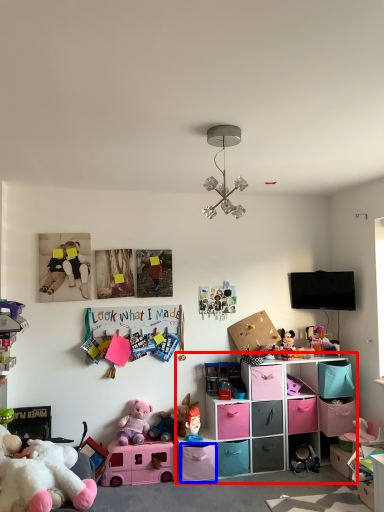
Question: Among these objects, which one is farthest to the camera, shelf (highlighted by a red box) or storage box (highlighted by a blue box)?

Choices:
 (A) shelf
 (B) storage box

Answer: (A)